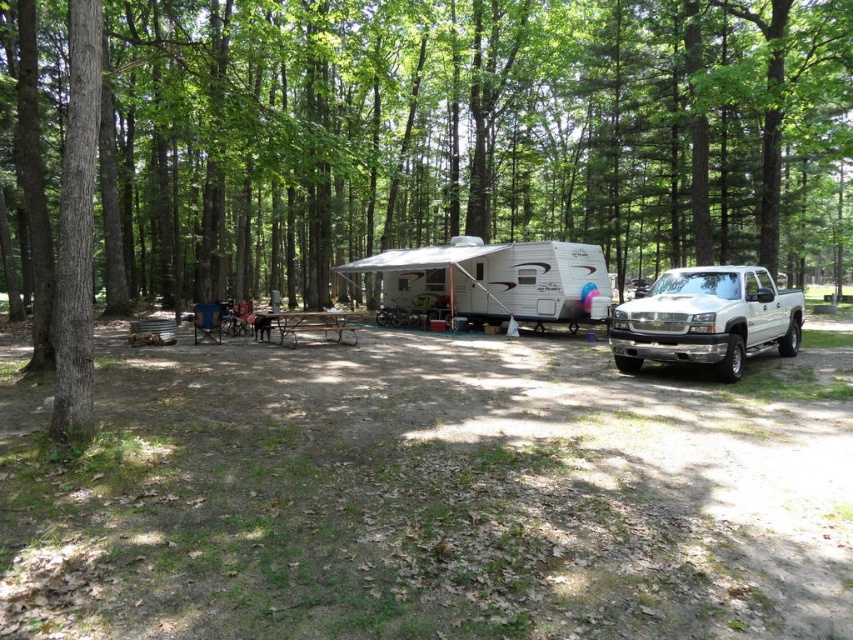
Question: Does white glossy pickup truck at right appear over brown metal picnic table at center?

Choices:
 (A) yes
 (B) no

Answer: (B)

Question: Estimate the real-world distances between objects in this image. Which object is farther from the brown textured tree at center?

Choices:
 (A) brown metal picnic table at center
 (B) white glossy pickup truck at right

Answer: (B)

Question: Does brown textured tree at center come behind brown metal picnic table at center?

Choices:
 (A) no
 (B) yes

Answer: (A)

Question: Which of the following is the closest to the observer?

Choices:
 (A) (352, 337)
 (B) (537, 17)

Answer: (A)

Question: Can you confirm if white glossy pickup truck at right is positioned above brown metal picnic table at center?

Choices:
 (A) yes
 (B) no

Answer: (B)

Question: Which object appears closest to the camera in this image?

Choices:
 (A) brown metal picnic table at center
 (B) brown textured tree at center

Answer: (B)